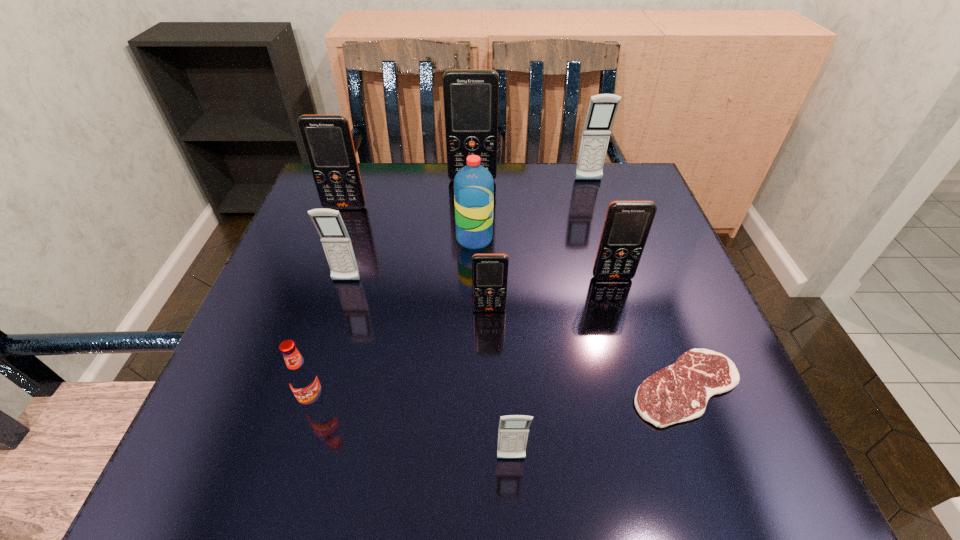
Image resolution: width=960 pixels, height=540 pixels. Identify the location of the tallest cellular telephone. pyautogui.click(x=471, y=97).

Identify the location of the farthest orange cellular telephone. The height and width of the screenshot is (540, 960). (471, 97).

Locate an element on the screen. This screenshot has height=540, width=960. the farthest gray cellular telephone is located at coordinates (602, 109).

The image size is (960, 540). I want to click on the biggest gray cellular telephone, so click(602, 109).

What are the coordinates of `the third farthest cellular telephone` in the screenshot? It's located at (327, 139).

Locate an element on the screen. the third smallest orange cellular telephone is located at coordinates (327, 139).

Where is `the fourth farthest object`? the fourth farthest object is located at coordinates (473, 184).

Find the location of a particular element. red water bottle is located at coordinates (473, 184).

This screenshot has width=960, height=540. I want to click on the leftmost gray cellular telephone, so click(335, 239).

Identify the location of the second nearest gray cellular telephone. The image size is (960, 540). (335, 239).